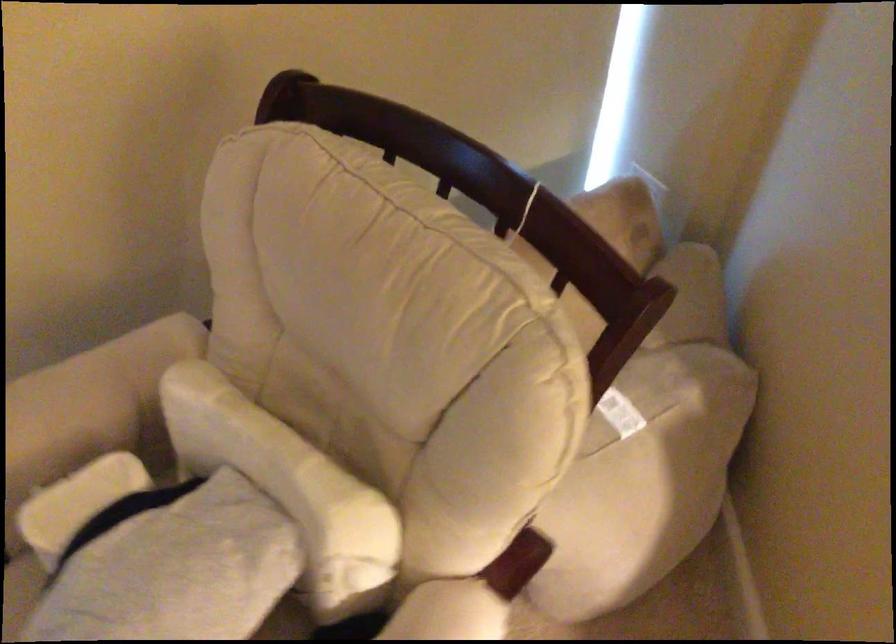
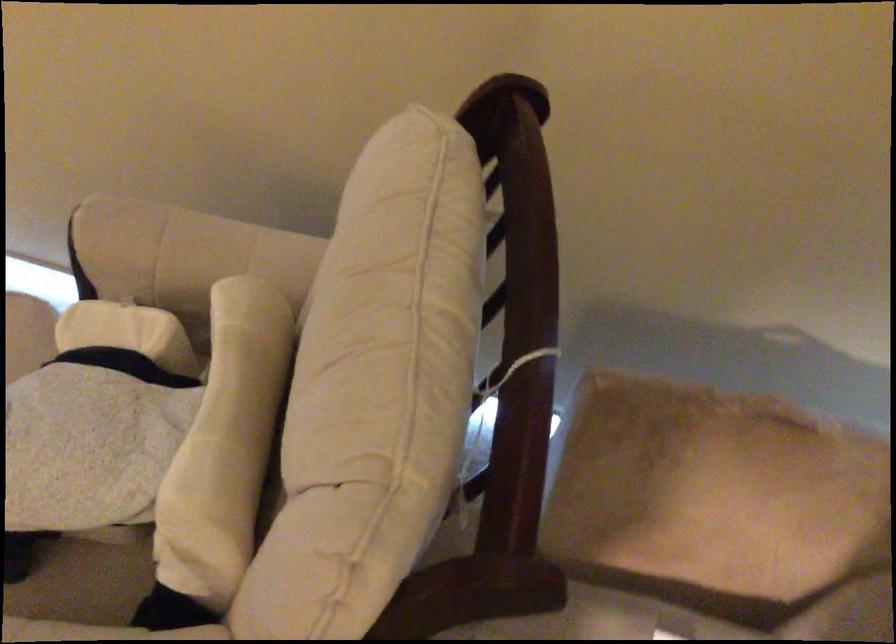
Question: Based on the continuous images, in which direction is the camera rotating? Reply with the corresponding letter.

Choices:
 (A) Left
 (B) Right
 (C) Up
 (D) Down

Answer: (A)